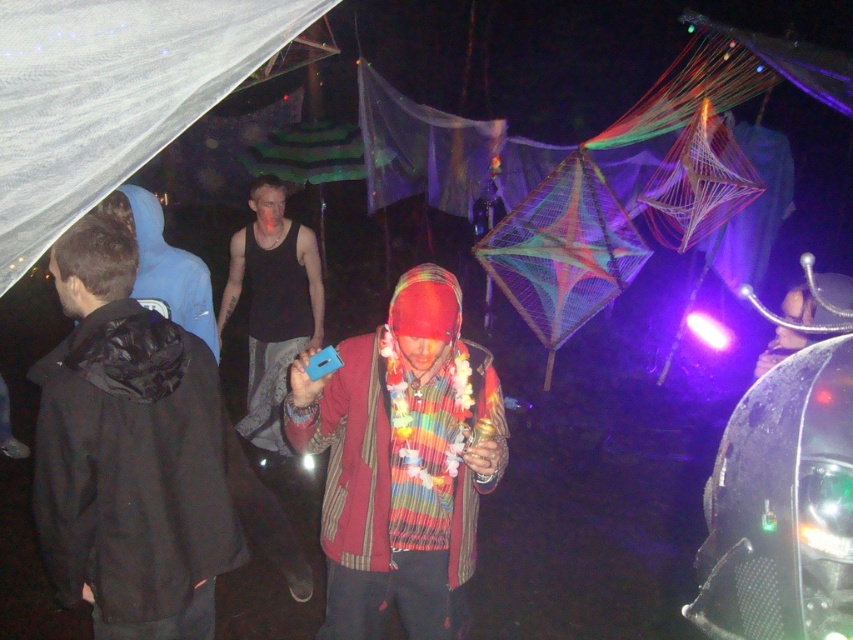
Question: Among these objects, which one is farthest from the camera?

Choices:
 (A) black tank top at center
 (B) black matte jacket at center
 (C) striped fabric scarf at center

Answer: (A)

Question: Does black matte jacket at center come behind black tank top at center?

Choices:
 (A) yes
 (B) no

Answer: (B)

Question: Which of the following is the closest to the observer?

Choices:
 (A) (265, 385)
 (B) (395, 458)
 (C) (90, 388)

Answer: (C)

Question: Is black matte jacket at center closer to the viewer compared to black tank top at center?

Choices:
 (A) no
 (B) yes

Answer: (B)

Question: Does black matte jacket at center appear over black tank top at center?

Choices:
 (A) yes
 (B) no

Answer: (B)

Question: Estimate the real-world distances between objects in this image. Which object is closer to the black matte jacket at center?

Choices:
 (A) black tank top at center
 (B) striped fabric scarf at center

Answer: (B)